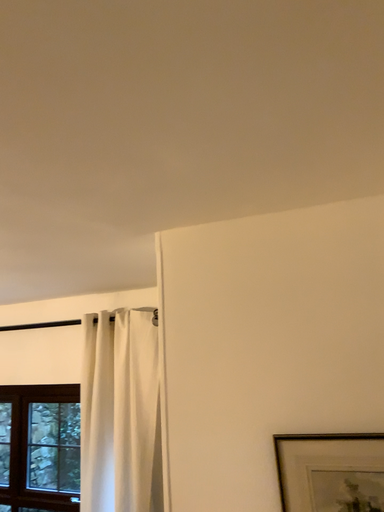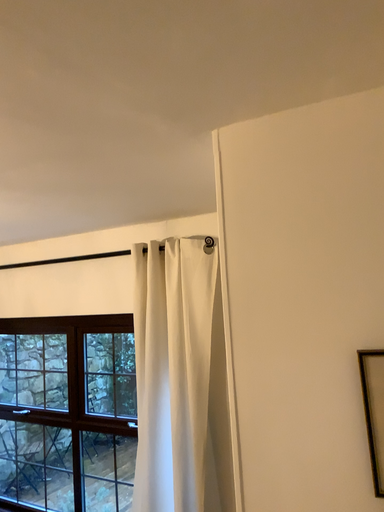
Question: How did the camera likely rotate when shooting the video?

Choices:
 (A) rotated downward
 (B) rotated upward

Answer: (A)